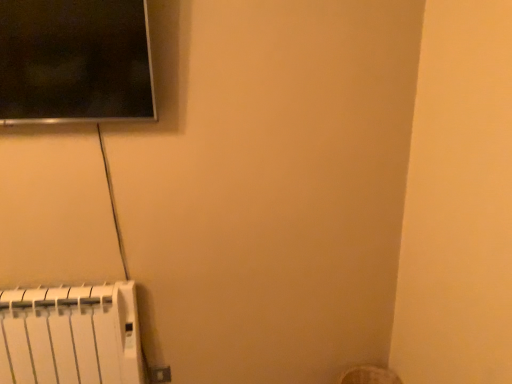
Question: Visually, is white plastic electric outlet at lower left positioned to the left or to the right of white plastic radiator at lower left?

Choices:
 (A) left
 (B) right

Answer: (B)

Question: From a real-world perspective, relative to white plastic radiator at lower left, is white plastic electric outlet at lower left vertically above or below?

Choices:
 (A) below
 (B) above

Answer: (A)

Question: Is point (169, 372) closer or farther from the camera than point (12, 337)?

Choices:
 (A) farther
 (B) closer

Answer: (A)

Question: From a real-world perspective, is white plastic radiator at lower left above or below white plastic electric outlet at lower left?

Choices:
 (A) below
 (B) above

Answer: (B)

Question: Is white plastic radiator at lower left wider or thinner than white plastic electric outlet at lower left?

Choices:
 (A) thin
 (B) wide

Answer: (B)

Question: Does point (20, 337) appear closer or farther from the camera than point (159, 380)?

Choices:
 (A) farther
 (B) closer

Answer: (B)

Question: Is white plastic radiator at lower left in front of or behind white plastic electric outlet at lower left in the image?

Choices:
 (A) behind
 (B) front

Answer: (B)